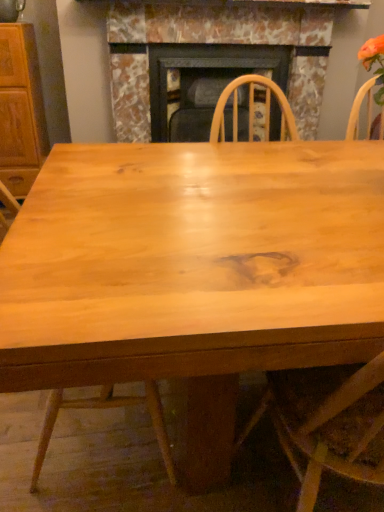
Question: Is marble fireplace at center surrounding natural wood chair at center?

Choices:
 (A) yes
 (B) no

Answer: (B)

Question: Does marble fireplace at center have a larger size compared to natural wood chair at center?

Choices:
 (A) yes
 (B) no

Answer: (A)

Question: Is marble fireplace at center to the left of natural wood chair at center from the viewer's perspective?

Choices:
 (A) yes
 (B) no

Answer: (B)

Question: From the image's perspective, does marble fireplace at center appear lower than natural wood chair at center?

Choices:
 (A) no
 (B) yes

Answer: (A)

Question: From a real-world perspective, is marble fireplace at center positioned over natural wood chair at center based on gravity?

Choices:
 (A) yes
 (B) no

Answer: (A)

Question: Considering the relative sizes of marble fireplace at center and natural wood chair at center in the image provided, is marble fireplace at center taller than natural wood chair at center?

Choices:
 (A) yes
 (B) no

Answer: (B)

Question: Is wooden cabinet at left further to camera compared to natural wood chair at center?

Choices:
 (A) no
 (B) yes

Answer: (B)

Question: From the image's perspective, does wooden cabinet at left appear higher than natural wood chair at center?

Choices:
 (A) no
 (B) yes

Answer: (B)

Question: From the image's perspective, is wooden cabinet at left beneath natural wood chair at center?

Choices:
 (A) no
 (B) yes

Answer: (A)

Question: Is wooden cabinet at left taller than natural wood chair at center?

Choices:
 (A) no
 (B) yes

Answer: (B)

Question: Is wooden cabinet at left in front of natural wood chair at center?

Choices:
 (A) no
 (B) yes

Answer: (A)

Question: Is wooden cabinet at left positioned far away from natural wood chair at center?

Choices:
 (A) no
 (B) yes

Answer: (B)

Question: Does wooden cabinet at left have a greater height compared to marble fireplace at center?

Choices:
 (A) yes
 (B) no

Answer: (A)